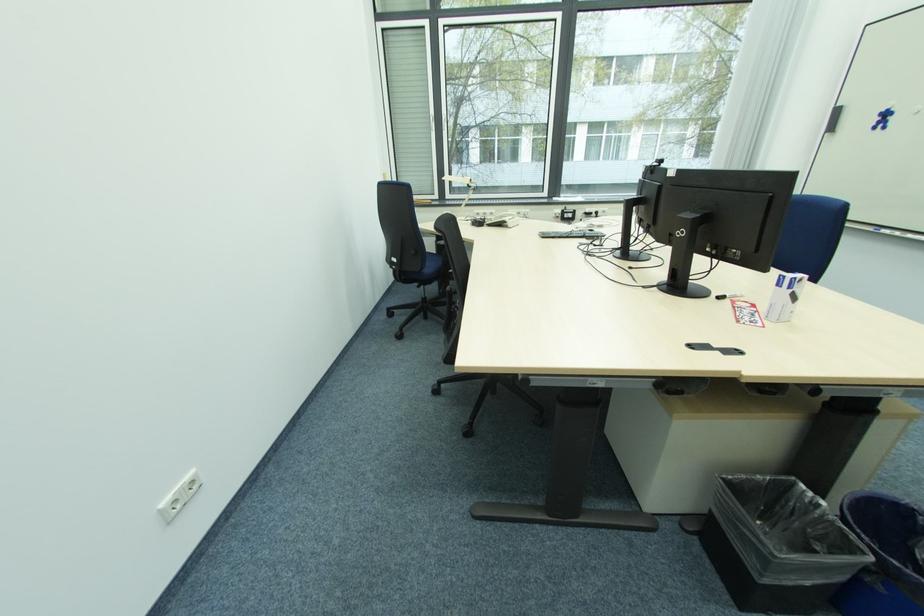
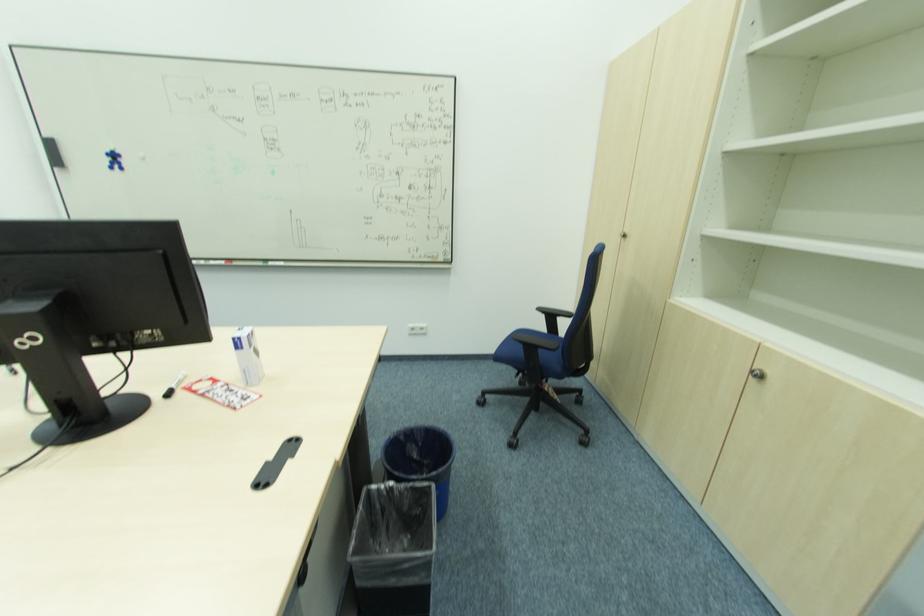
Based on the continuous images, in which direction is the camera rotating?

The rotation direction of the camera is right-down.